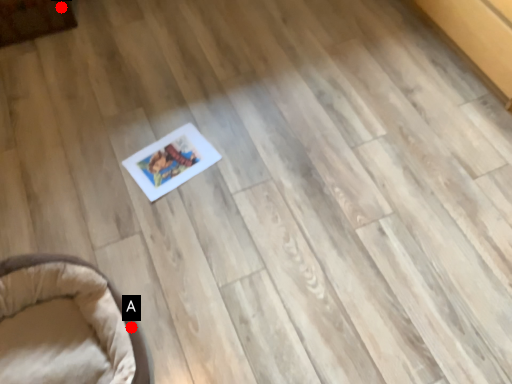
Question: Two points are circled on the image, labeled by A and B beside each circle. Which point is further to the camera?

Choices:
 (A) A is further
 (B) B is further

Answer: (B)